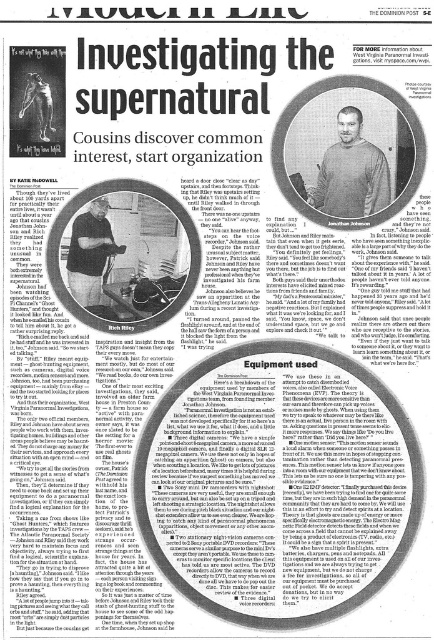
Locate an element on the screen. matte gray sweater at center is located at coordinates (351, 172).

Find the location of a particular element. This screenshot has height=640, width=434. matte gray sweater at center is located at coordinates (351, 172).